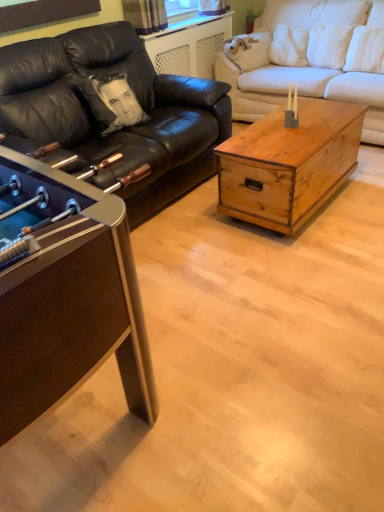
The image size is (384, 512). I want to click on free space in front of rustic wood trunk at center, positioned as the second coffee table in left-to-right order, so click(299, 265).